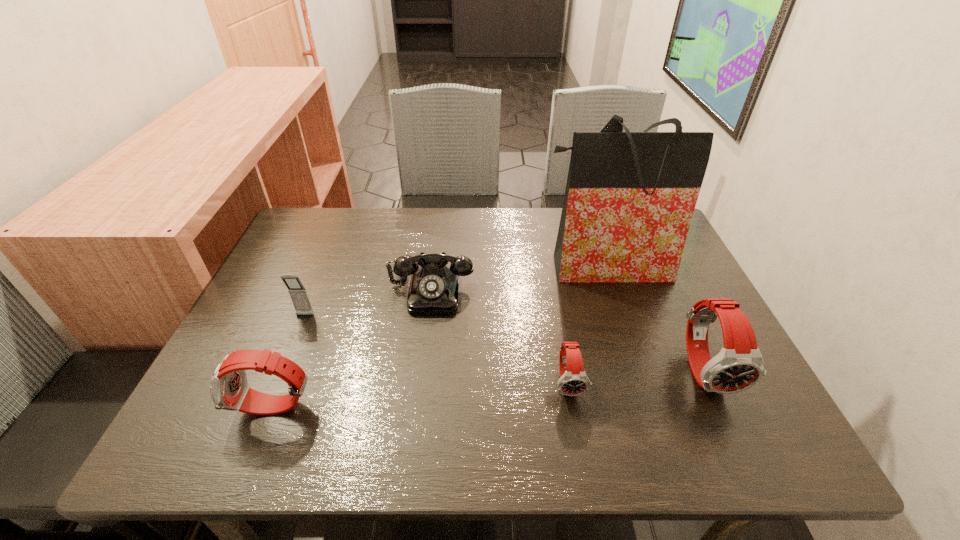
The image size is (960, 540). In order to click on blank area in the image that satisfies the following two spatial constraints: 1. on the dial of the fourth object from right to left; 2. on the face of the leftmost watch in this screenshot , I will do `click(417, 408)`.

Locate an element on the screen. This screenshot has width=960, height=540. free spot that satisfies the following two spatial constraints: 1. on the dial of the fourth object from right to left; 2. on the face of the leftmost watch is located at coordinates (417, 408).